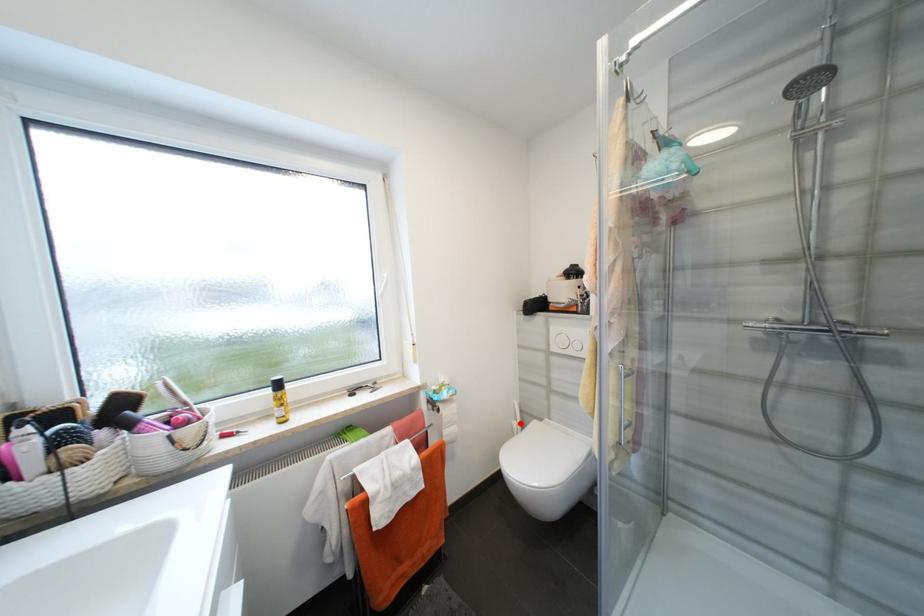
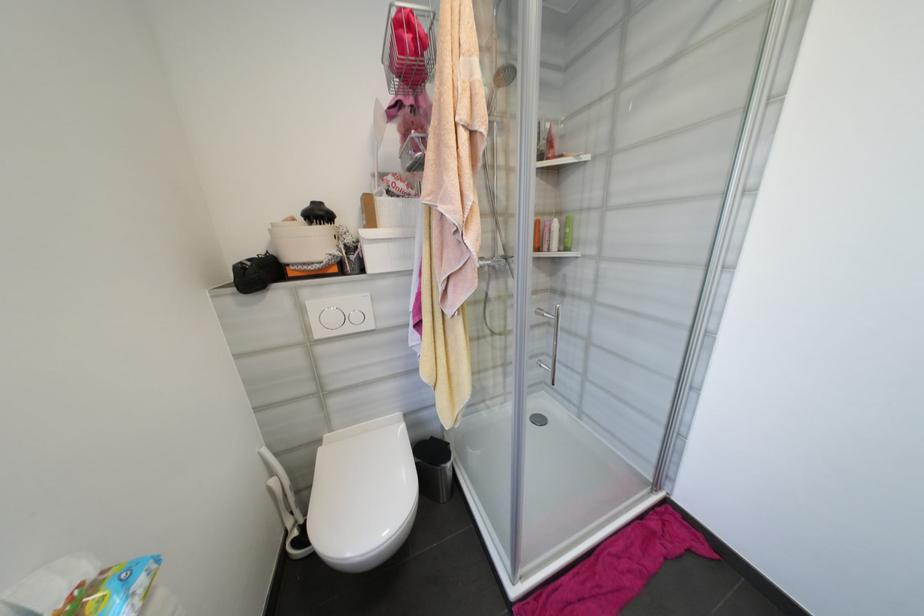
Where in the second image is the point corresponding to the highlighted location from the first image?

(277, 482)